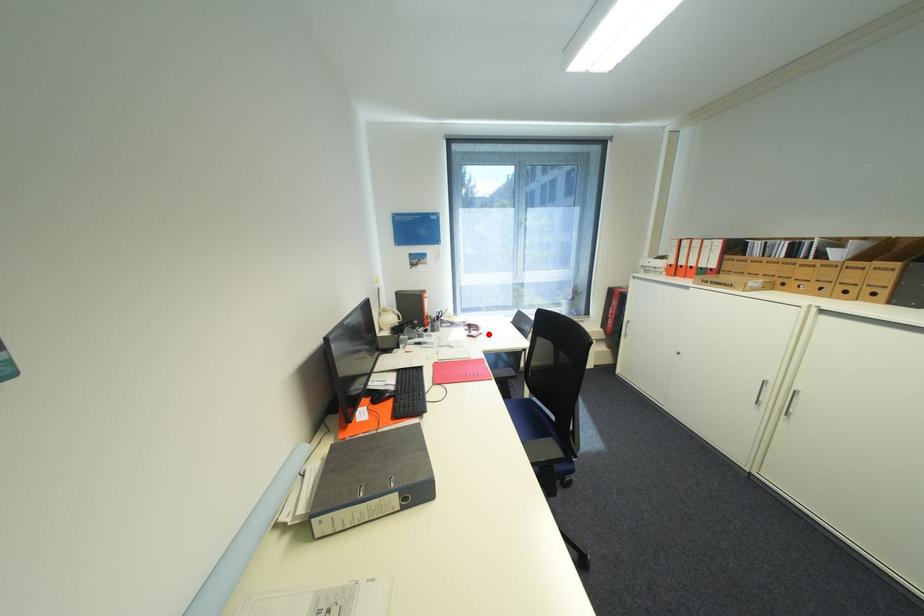
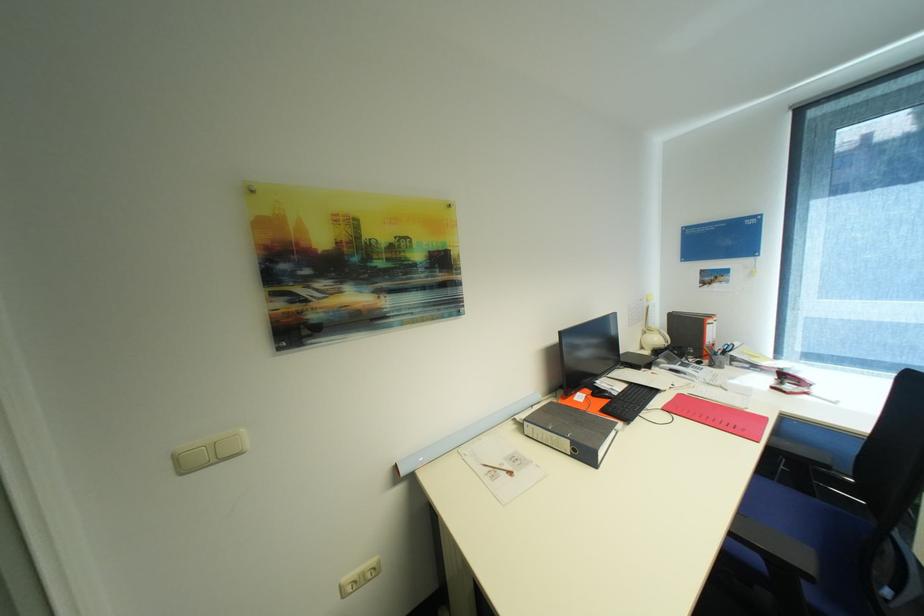
The point at the highlighted location is marked in the first image. Where is the corresponding point in the second image?

(813, 394)